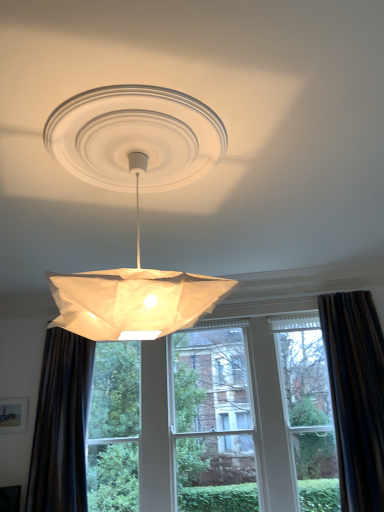
Question: Is dark brown textured curtain at left, the second curtain from the right, taller or shorter than white paper lampshade at center?

Choices:
 (A) tall
 (B) short

Answer: (A)

Question: Considering their positions, is dark brown textured curtain at left, the second curtain from the right, located in front of or behind white paper lampshade at center?

Choices:
 (A) front
 (B) behind

Answer: (B)

Question: Which object is positioned farthest from the transparent glass window at center?

Choices:
 (A) dark brown textured curtain at left, the second curtain from the right
 (B) white paper lampshade at center
 (C) dark fabric curtain at right, which appears as the second curtain when viewed from the left

Answer: (B)

Question: Which is farther from the transparent glass window at center?

Choices:
 (A) dark brown textured curtain at left, the second curtain from the right
 (B) white paper lampshade at center
 (C) dark fabric curtain at right, which appears as the second curtain when viewed from the left

Answer: (B)